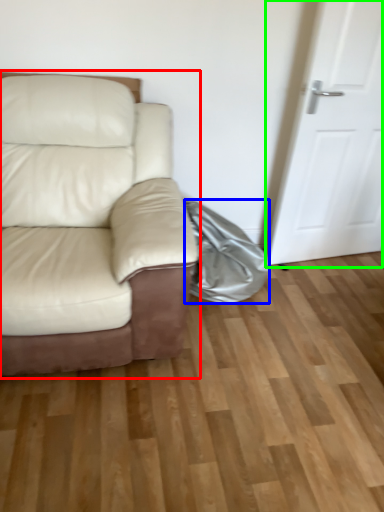
Question: Which object is the closest to the studio couch (highlighted by a red box)? Choose among these: material (highlighted by a blue box) or door (highlighted by a green box).

Choices:
 (A) material
 (B) door

Answer: (A)